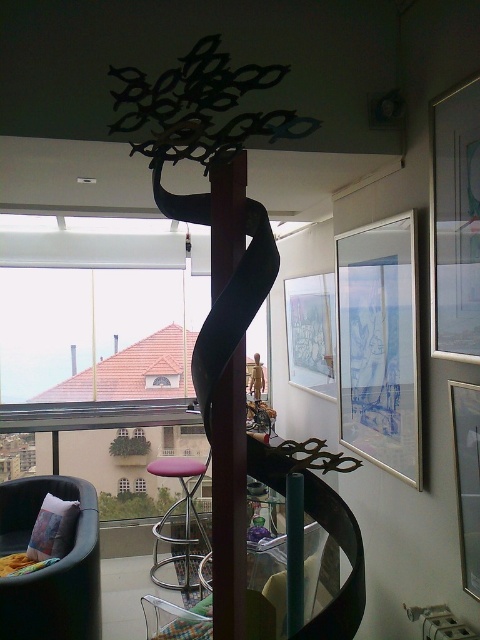
Is point (381, 236) positioned behind point (186, 584)?

That is False.

Between silver metallic picture frame at right and purple fabric stool at center, which one has more height?

silver metallic picture frame at right is taller.

What do you see at coordinates (380, 344) in the screenshot? The image size is (480, 640). I see `silver metallic picture frame at right` at bounding box center [380, 344].

Locate an element on the screen. The width and height of the screenshot is (480, 640). silver metallic picture frame at right is located at coordinates (380, 344).

Which is behind, point (313, 372) or point (478, 448)?

Point (313, 372)

Does matte glass picture frame at upper center appear under metallic silver picture frame at right?

No.

At what (x,y) coordinates should I click in order to perform the action: click on matte glass picture frame at upper center. Please return your answer as a coordinate pair (x, y). Looking at the image, I should click on coord(311,332).

Where is `matte glass picture frame at upper center`? Image resolution: width=480 pixels, height=640 pixels. matte glass picture frame at upper center is located at coordinates (311, 332).

This screenshot has height=640, width=480. What are the coordinates of `matte glass picture frame at upper right` in the screenshot? It's located at (455, 225).

Is matte glass picture frame at upper right further to the viewer compared to velvet green armchair at lower left?

No, it is not.

Between point (471, 230) and point (54, 612), which one is positioned in front?

Positioned in front is point (471, 230).

Locate an element on the screen. The width and height of the screenshot is (480, 640). matte glass picture frame at upper right is located at coordinates (455, 225).